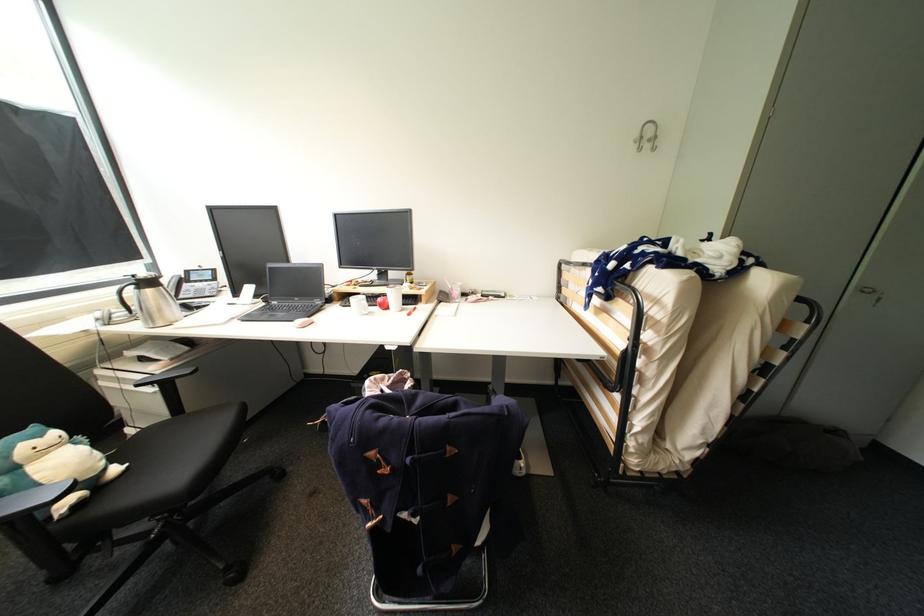
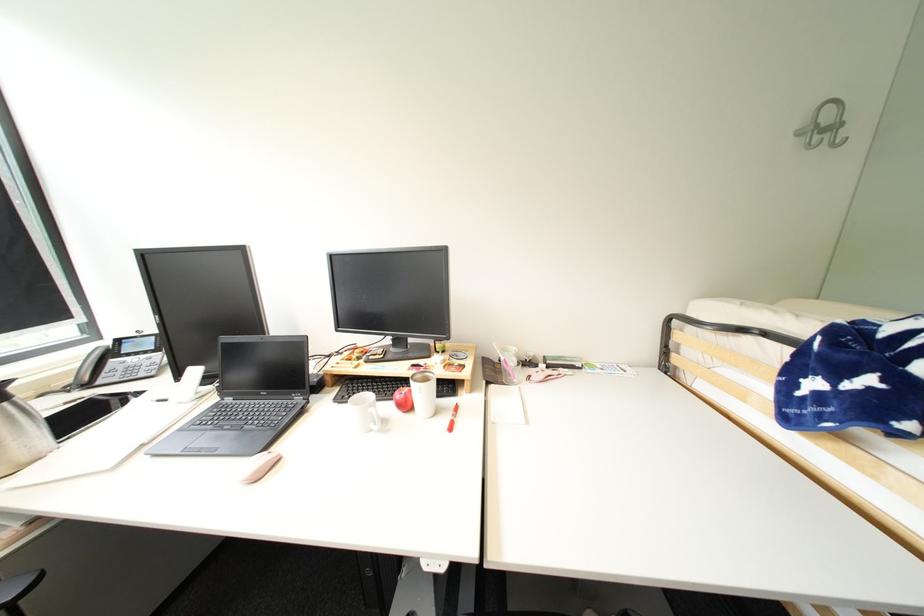
Question: The first image is from the beginning of the video and the second image is from the end. How did the camera likely rotate when shooting the video?

Choices:
 (A) Left
 (B) Right
 (C) Up
 (D) Down

Answer: (C)